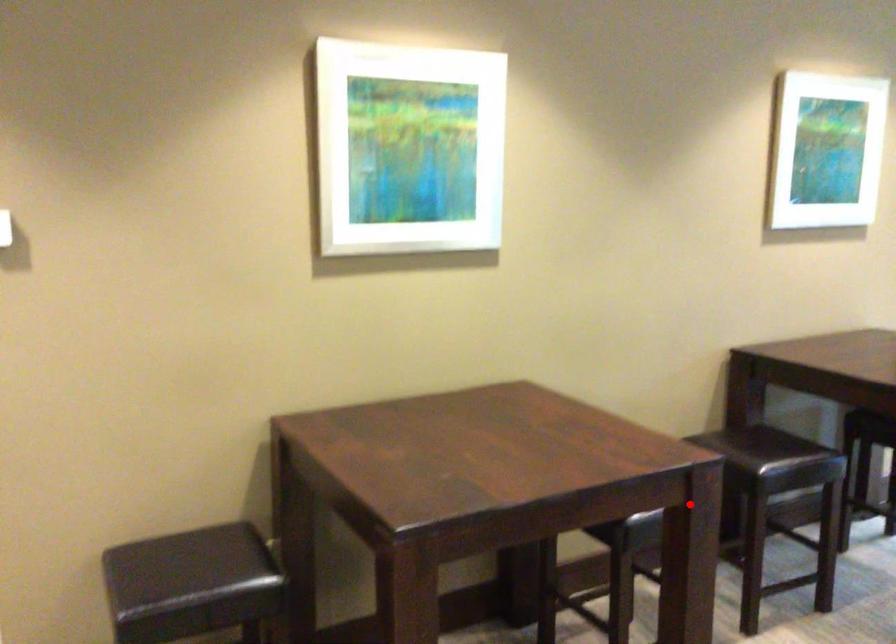
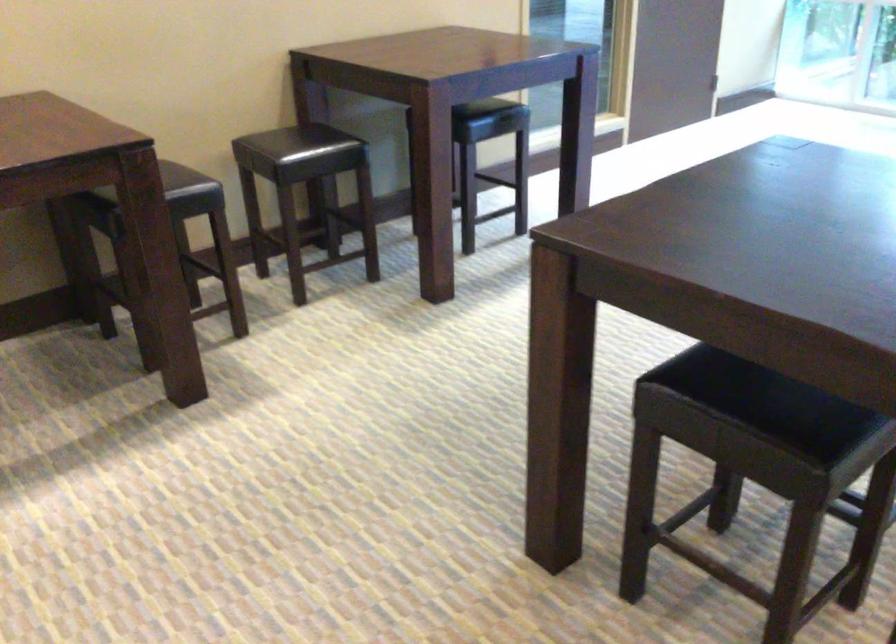
Question: I am providing you with two images of the same scene from different viewpoints. Given a red point in image1, look at the same physical point in image2. Is it:

Choices:
 (A) Closer to the viewpoint
 (B) Farther from the viewpoint

Answer: (B)